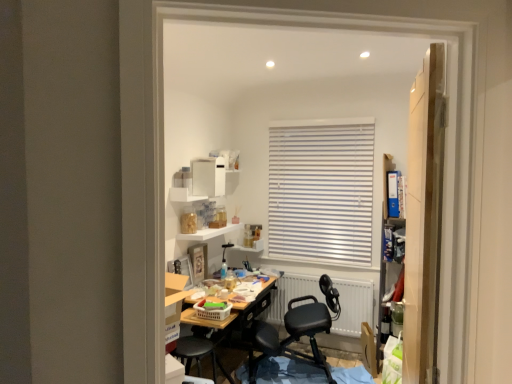
Image resolution: width=512 pixels, height=384 pixels. Describe the element at coordinates (184, 195) in the screenshot. I see `white glossy shelf at upper center, acting as the second shelf starting from the bottom` at that location.

What do you see at coordinates (212, 310) in the screenshot?
I see `plastic laundry basket at center` at bounding box center [212, 310].

Locate an element on the screen. The height and width of the screenshot is (384, 512). plastic laundry basket at center is located at coordinates (212, 310).

This screenshot has height=384, width=512. Describe the element at coordinates (209, 233) in the screenshot. I see `white matte shelf at upper center, which is counted as the 2th shelf, starting from the top` at that location.

Find the location of a particular element. This screenshot has height=384, width=512. white glossy shelf at upper center, the first shelf positioned from the top is located at coordinates (184, 195).

Looking at this image, who is bigger, wooden door at right or white matte radiator at center?

With larger size is wooden door at right.

Does wooden door at right have a lesser width compared to white matte radiator at center?

Incorrect, the width of wooden door at right is not less than that of white matte radiator at center.

From a real-world perspective, relative to white matte radiator at center, is wooden door at right vertically above or below?

In terms of real-world spatial position, wooden door at right is above white matte radiator at center.

Which is correct: white matte shelf at upper center, which is counted as the 2th shelf, starting from the top, is inside wooden door at right, or outside of it?

white matte shelf at upper center, which is counted as the 2th shelf, starting from the top, is not inside wooden door at right, it's outside.

Considering the positions of points (220, 232) and (442, 54), is point (220, 232) farther from camera compared to point (442, 54)?

Yes, point (220, 232) is behind point (442, 54).

Considering the sizes of objects white matte shelf at upper center, marked as the 1th shelf in a bottom-to-top arrangement, and wooden door at right in the image provided, who is shorter, white matte shelf at upper center, marked as the 1th shelf in a bottom-to-top arrangement, or wooden door at right?

Standing shorter between the two is white matte shelf at upper center, marked as the 1th shelf in a bottom-to-top arrangement.

From a real-world perspective, is white glossy shelf at upper center, the first shelf positioned from the top, above or below white matte shelf at upper center, marked as the 1th shelf in a bottom-to-top arrangement?

white glossy shelf at upper center, the first shelf positioned from the top, is situated higher than white matte shelf at upper center, marked as the 1th shelf in a bottom-to-top arrangement, in the real world.

Between white glossy shelf at upper center, acting as the second shelf starting from the bottom, and white matte shelf at upper center, marked as the 1th shelf in a bottom-to-top arrangement, which one appears on the right side from the viewer's perspective?

white matte shelf at upper center, marked as the 1th shelf in a bottom-to-top arrangement, is more to the right.

Is white glossy shelf at upper center, acting as the second shelf starting from the bottom, oriented towards white matte shelf at upper center, which is counted as the 2th shelf, starting from the top?

No, white glossy shelf at upper center, acting as the second shelf starting from the bottom, is not facing towards white matte shelf at upper center, which is counted as the 2th shelf, starting from the top.

Is black leather office chair at center not near plastic laundry basket at center?

No, black leather office chair at center is in close proximity to plastic laundry basket at center.

From a real-world perspective, is black leather office chair at center on plastic laundry basket at center?

A: No, from a real-world perspective, black leather office chair at center is not above plastic laundry basket at center.

From the image's perspective, between black leather office chair at center and plastic laundry basket at center, who is located below?

black leather office chair at center is shown below in the image.

From the image's perspective, between plastic laundry basket at center and wooden door at right, who is located below?

From the image's view, plastic laundry basket at center is below.

Is plastic laundry basket at center thinner than wooden door at right?

Incorrect, the width of plastic laundry basket at center is not less than that of wooden door at right.

Can you tell me how much plastic laundry basket at center and wooden door at right differ in facing direction?

They differ by 174 degrees in their facing directions.

Based on their positions, is plastic laundry basket at center located to the left or right of wooden door at right?

Based on their positions, plastic laundry basket at center is located to the left of wooden door at right.

Considering their positions, is white matte radiator at center located in front of or behind plastic laundry basket at center?

In the image, white matte radiator at center appears behind plastic laundry basket at center.

Is white matte radiator at center far away from plastic laundry basket at center?

Yes, white matte radiator at center and plastic laundry basket at center are located far from each other.

Which object is wider, white matte radiator at center or plastic laundry basket at center?

plastic laundry basket at center is wider.

Where is `laundry basket in front of the white matte radiator at center`? laundry basket in front of the white matte radiator at center is located at coordinates (212, 310).

Are white matte radiator at center and wooden door at right located far from each other?

Yes, white matte radiator at center is far from wooden door at right.

From a real-world perspective, is white matte radiator at center under wooden door at right?

Indeed, from a real-world perspective, white matte radiator at center is positioned beneath wooden door at right.

Between point (300, 304) and point (444, 100), which one is positioned in front?

The point (444, 100) is closer to the camera.

Is white matte radiator at center to the left of wooden door at right from the viewer's perspective?

Correct, you'll find white matte radiator at center to the left of wooden door at right.

Image resolution: width=512 pixels, height=384 pixels. I want to click on radiator below the wooden door at right (from the image's perspective), so click(x=353, y=306).

You are a GUI agent. You are given a task and a screenshot of the screen. Output one action in this format:
    pyautogui.click(x=<x>, y=<y>)
    Task: Click on the 1st shelf to the left of the wooden door at right, starting your count from the anchor
    The image size is (512, 384).
    Given the screenshot: What is the action you would take?
    (209, 233)

Based on their spatial positions, is white glossy shelf at upper center, the first shelf positioned from the top, or white matte shelf at upper center, marked as the 1th shelf in a bottom-to-top arrangement, further from black leather office chair at center?

white glossy shelf at upper center, the first shelf positioned from the top, lies further to black leather office chair at center than the other object.

Estimate the real-world distances between objects in this image. Which object is further from white matte shelf at upper center, which is counted as the 2th shelf, starting from the top, plastic laundry basket at center or white matte radiator at center?

white matte radiator at center.

When comparing their distances from white matte shelf at upper center, marked as the 1th shelf in a bottom-to-top arrangement, does plastic laundry basket at center or white glossy shelf at upper center, the first shelf positioned from the top, seem closer?

white glossy shelf at upper center, the first shelf positioned from the top, is positioned closer to the anchor white matte shelf at upper center, marked as the 1th shelf in a bottom-to-top arrangement.

Considering their positions, is white glossy shelf at upper center, acting as the second shelf starting from the bottom, positioned further to white matte radiator at center than wooden door at right?

wooden door at right lies further to white matte radiator at center than the other object.

Based on their spatial positions, is wooden door at right or white matte shelf at upper center, which is counted as the 2th shelf, starting from the top, closer to black leather office chair at center?

Among the two, white matte shelf at upper center, which is counted as the 2th shelf, starting from the top, is located nearer to black leather office chair at center.

Considering their positions, is wooden door at right positioned closer to white matte shelf at upper center, which is counted as the 2th shelf, starting from the top, than plastic laundry basket at center?

plastic laundry basket at center is positioned closer to the anchor white matte shelf at upper center, which is counted as the 2th shelf, starting from the top.

Considering their positions, is wooden door at right positioned closer to white matte shelf at upper center, marked as the 1th shelf in a bottom-to-top arrangement, than white glossy shelf at upper center, the first shelf positioned from the top?

white glossy shelf at upper center, the first shelf positioned from the top, is positioned closer to the anchor white matte shelf at upper center, marked as the 1th shelf in a bottom-to-top arrangement.

Estimate the real-world distances between objects in this image. Which object is further from black leather office chair at center, wooden door at right or white glossy shelf at upper center, acting as the second shelf starting from the bottom?

Among the two, wooden door at right is located further to black leather office chair at center.

In order to click on chair between wooden door at right and white glossy shelf at upper center, the first shelf positioned from the top, in the front-back direction in this screenshot , I will do `click(297, 330)`.

Identify the location of chair located between plastic laundry basket at center and white matte radiator at center in the left-right direction. (297, 330).

Where is `laundry basket between wooden door at right and white glossy shelf at upper center, acting as the second shelf starting from the bottom, in the front-back direction`? This screenshot has height=384, width=512. laundry basket between wooden door at right and white glossy shelf at upper center, acting as the second shelf starting from the bottom, in the front-back direction is located at coordinates (212, 310).

At what (x,y) coordinates should I click in order to perform the action: click on laundry basket between wooden door at right and black leather office chair at center along the z-axis. Please return your answer as a coordinate pair (x, y). Image resolution: width=512 pixels, height=384 pixels. Looking at the image, I should click on (x=212, y=310).